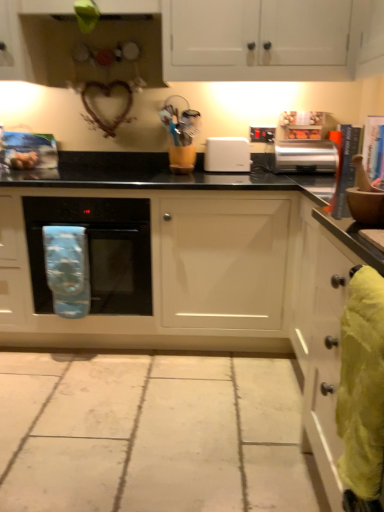
Question: Is white matte cabinet at upper center, the first cabinetry from the top, not near yellow fabric towel at right, marked as the 1th material in a right-to-left arrangement?

Choices:
 (A) no
 (B) yes

Answer: (B)

Question: Is white matte cabinet at upper center, which is counted as the 3th cabinetry, starting from the bottom, wider than yellow fabric towel at right, marked as the 1th material in a right-to-left arrangement?

Choices:
 (A) no
 (B) yes

Answer: (B)

Question: Is white matte cabinet at upper center, the first cabinetry from the top, oriented towards yellow fabric towel at right, the second material from the left?

Choices:
 (A) yes
 (B) no

Answer: (B)

Question: Considering the relative positions of white matte cabinet at upper center, which is counted as the 3th cabinetry, starting from the bottom, and yellow fabric towel at right, marked as the 1th material in a right-to-left arrangement, in the image provided, is white matte cabinet at upper center, which is counted as the 3th cabinetry, starting from the bottom, to the left of yellow fabric towel at right, marked as the 1th material in a right-to-left arrangement, from the viewer's perspective?

Choices:
 (A) no
 (B) yes

Answer: (B)

Question: Is white matte cabinet at upper center, the first cabinetry from the top, shorter than yellow fabric towel at right, marked as the 1th material in a right-to-left arrangement?

Choices:
 (A) no
 (B) yes

Answer: (A)

Question: From the image's perspective, is yellow fabric towel at right, the second material from the left, above or below black glass microwave at center?

Choices:
 (A) above
 (B) below

Answer: (B)

Question: Is point (342, 435) closer or farther from the camera than point (134, 280)?

Choices:
 (A) closer
 (B) farther

Answer: (A)

Question: Looking at the image, does yellow fabric towel at right, which appears as the second material when viewed from the back, seem bigger or smaller compared to black glass microwave at center?

Choices:
 (A) small
 (B) big

Answer: (A)

Question: Based on their positions, is yellow fabric towel at right, which appears as the second material when viewed from the back, located to the left or right of black glass microwave at center?

Choices:
 (A) right
 (B) left

Answer: (A)

Question: Is blue fabric oven mitt at left, which is the first material from left to right, situated inside black glass microwave at center or outside?

Choices:
 (A) outside
 (B) inside

Answer: (B)

Question: Is blue fabric oven mitt at left, which ranks as the 2th material in right-to-left order, to the left or to the right of black glass microwave at center in the image?

Choices:
 (A) right
 (B) left

Answer: (B)

Question: From their relative heights in the image, would you say blue fabric oven mitt at left, which is the first material from left to right, is taller or shorter than black glass microwave at center?

Choices:
 (A) short
 (B) tall

Answer: (A)

Question: Considering their positions, is blue fabric oven mitt at left, acting as the first material starting from the back, located in front of or behind black glass microwave at center?

Choices:
 (A) behind
 (B) front

Answer: (B)

Question: Looking at their shapes, would you say yellow fabric towel at right, the 1th material positioned from the front, is wider or thinner than satin silver toaster at upper right?

Choices:
 (A) thin
 (B) wide

Answer: (A)

Question: Is point (370, 392) positioned closer to the camera than point (291, 140)?

Choices:
 (A) farther
 (B) closer

Answer: (B)